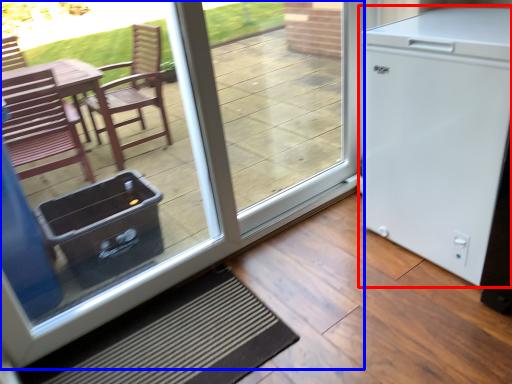
Question: Among these objects, which one is nearest to the camera, refrigerator (highlighted by a red box) or door (highlighted by a blue box)?

Choices:
 (A) refrigerator
 (B) door

Answer: (B)